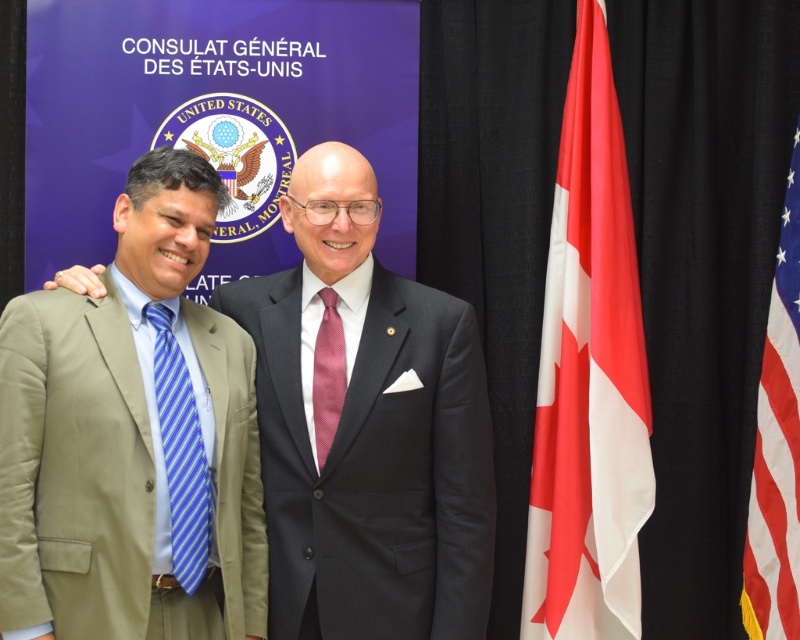
Question: Which point appears farthest from the camera in this image?

Choices:
 (A) (164, 404)
 (B) (308, 625)
 (C) (5, 392)

Answer: (B)

Question: Which point is closer to the camera taking this photo?

Choices:
 (A) (406, 532)
 (B) (332, 372)
 (C) (182, 372)
 (D) (622, 291)

Answer: (C)

Question: Estimate the real-world distances between objects in this image. Which object is closer to the white fabric flag at right?

Choices:
 (A) tan fabric suit at left
 (B) black wool suit at center
 (C) red-white striped fabric at right
 (D) khaki cotton suit at left

Answer: (C)

Question: From the image, what is the correct spatial relationship of tan fabric suit at left in relation to purple textured tie at center?

Choices:
 (A) right
 (B) left

Answer: (B)

Question: Can you confirm if blue striped tie at left is smaller than purple textured tie at center?

Choices:
 (A) no
 (B) yes

Answer: (A)

Question: Where is black wool suit at center located in relation to purple textured tie at center in the image?

Choices:
 (A) above
 (B) below

Answer: (B)